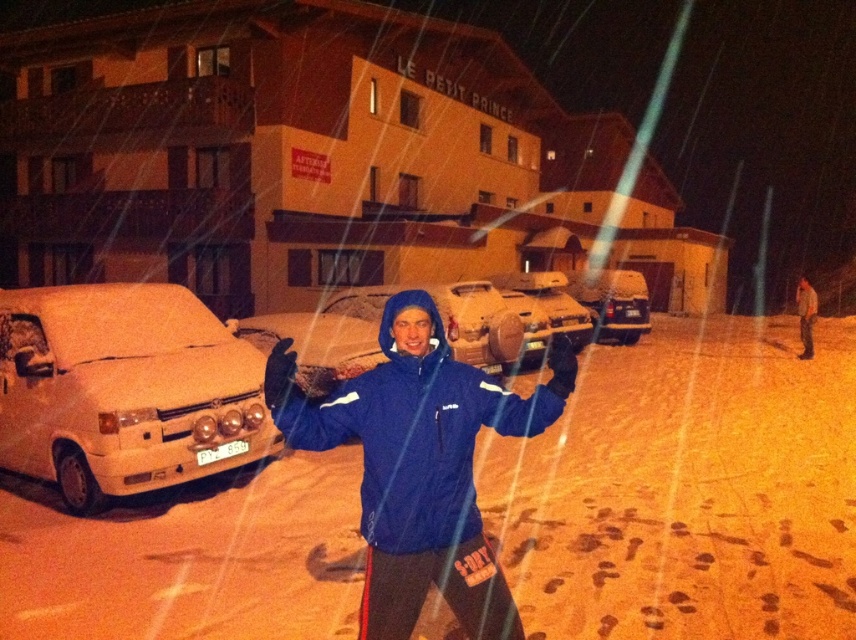
Question: Which of the following is the farthest from the observer?

Choices:
 (A) snow-covered sedan at center
 (B) white matte car at left

Answer: (A)

Question: Based on their relative distances, which object is farther from the snow-covered sedan at center?

Choices:
 (A) white matte car at left
 (B) blue matte jacket at center

Answer: (B)

Question: Does white matte car at left have a greater width compared to blue matte jacket at center?

Choices:
 (A) yes
 (B) no

Answer: (A)

Question: Among these objects, which one is nearest to the camera?

Choices:
 (A) snow-covered sedan at center
 (B) blue matte jacket at center

Answer: (B)

Question: In this image, where is white matte car at left located relative to blue matte jacket at center?

Choices:
 (A) right
 (B) left

Answer: (B)

Question: Does white matte car at left appear under snow-covered sedan at center?

Choices:
 (A) yes
 (B) no

Answer: (A)